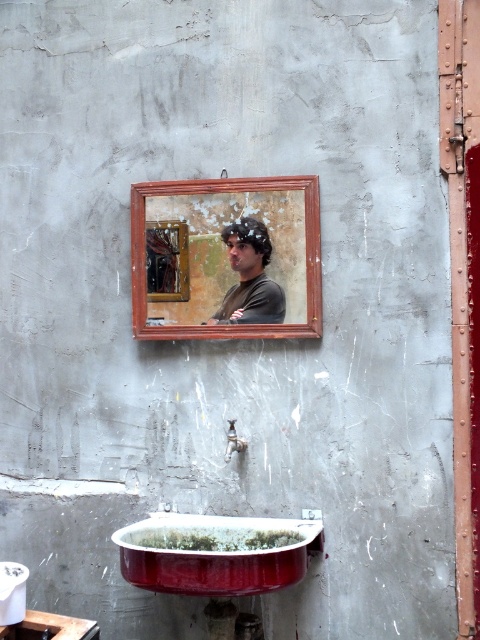
You are standing in a bathroom and want to clean the red enameled sink at lower center and the matte black shirt at center. Which object should you clean first if you want to start with the one nearest to you?

You should clean the red enameled sink at lower center first because it is closer to you than the matte black shirt at center.

From the picture: You are trying to fix a leak under the sink. You see the red enameled sink at lower center and the matte silver faucet at lower center. Which object is positioned higher in the image?

The matte silver faucet at lower center is positioned higher because the red enameled sink at lower center is located below it.